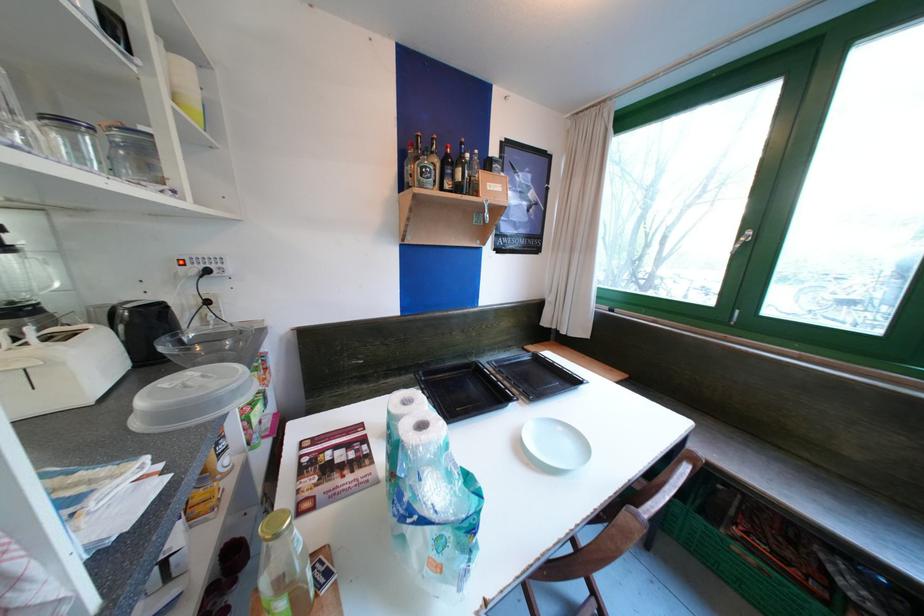
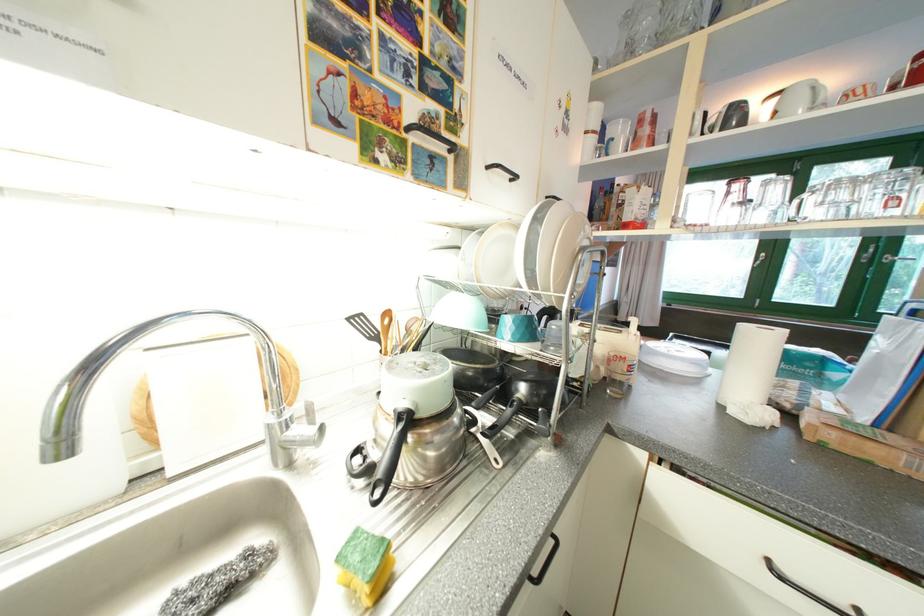
Question: I am providing you with two images of the same scene from different viewpoints. After the viewpoint changes to image2, which objects are now occluded?

Choices:
 (A) silver thermos handle
 (B) black pan handle
 (C) black cabinet handle
 (D) black baking tray

Answer: (D)